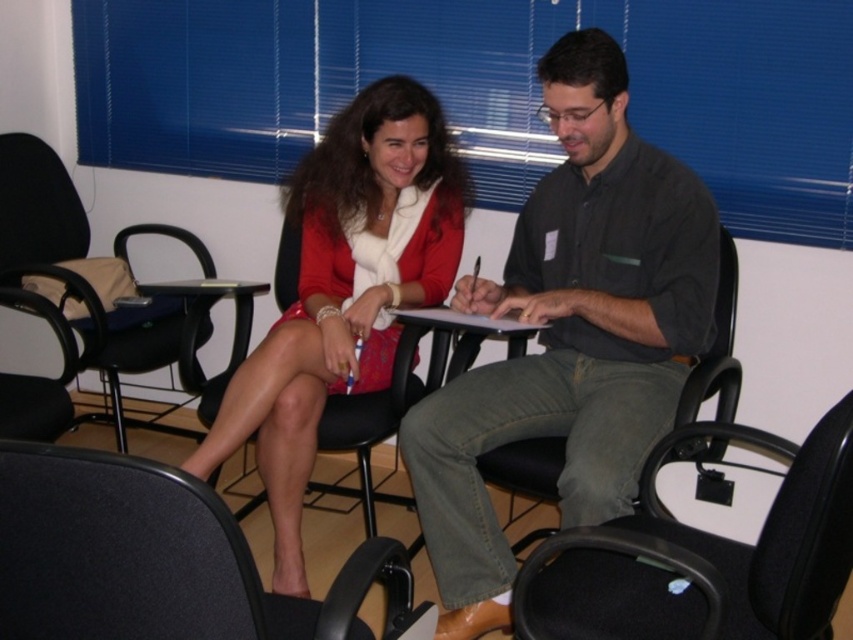
You are a GUI agent. You are given a task and a screenshot of the screen. Output one action in this format:
    pyautogui.click(x=<x>, y=<y>)
    Task: Click on the dark gray shirt at center
    The width and height of the screenshot is (853, 640).
    Given the screenshot: What is the action you would take?
    pyautogui.click(x=569, y=333)

Is point (622, 502) closer to viewer compared to point (537, 504)?

That is True.

Where is `dark gray shirt at center`? The image size is (853, 640). dark gray shirt at center is located at coordinates (569, 333).

Between point (521, 312) and point (689, 452), which one is positioned behind?

The point (521, 312) is behind.

Does point (614, 497) come behind point (732, 362)?

No, (614, 497) is closer to viewer.

Is point (650, 188) positioned behind point (518, 452)?

No, (650, 188) is in front of (518, 452).

Locate an element on the screen. This screenshot has width=853, height=640. dark gray shirt at center is located at coordinates (569, 333).

Is black fabric chair at left closer to the viewer compared to black plastic table at center?

Yes, it is in front of black plastic table at center.

Does black fabric chair at left lie behind black plastic table at center?

No, it is in front of black plastic table at center.

Locate an element on the screen. Image resolution: width=853 pixels, height=640 pixels. black fabric chair at left is located at coordinates (68, 298).